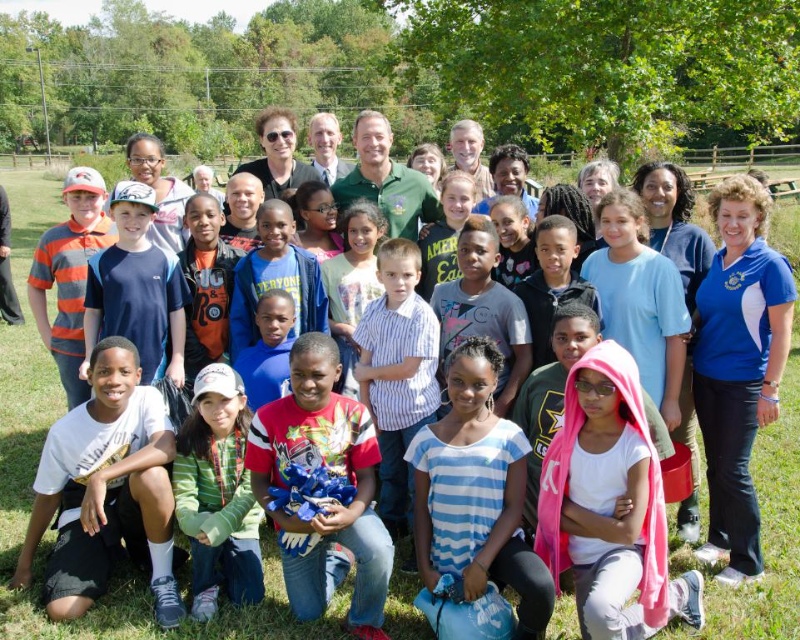
Question: Which object is farther from the camera taking this photo?

Choices:
 (A) blue striped shirt at center
 (B) red cotton shirt at center
 (C) green fleece jacket at lower center

Answer: (C)

Question: Can you confirm if blue striped shirt at center is thinner than green fleece jacket at lower center?

Choices:
 (A) yes
 (B) no

Answer: (B)

Question: Considering the real-world distances, which object is farthest from the red cotton shirt at center?

Choices:
 (A) green fleece jacket at lower center
 (B) blue striped shirt at center

Answer: (B)

Question: Can you confirm if blue striped shirt at center is positioned above green fleece jacket at lower center?

Choices:
 (A) no
 (B) yes

Answer: (B)

Question: Where is blue striped shirt at center located in relation to red cotton shirt at center in the image?

Choices:
 (A) above
 (B) below

Answer: (B)

Question: Among these points, which one is farthest from the camera?

Choices:
 (A) (360, 516)
 (B) (470, 506)

Answer: (B)